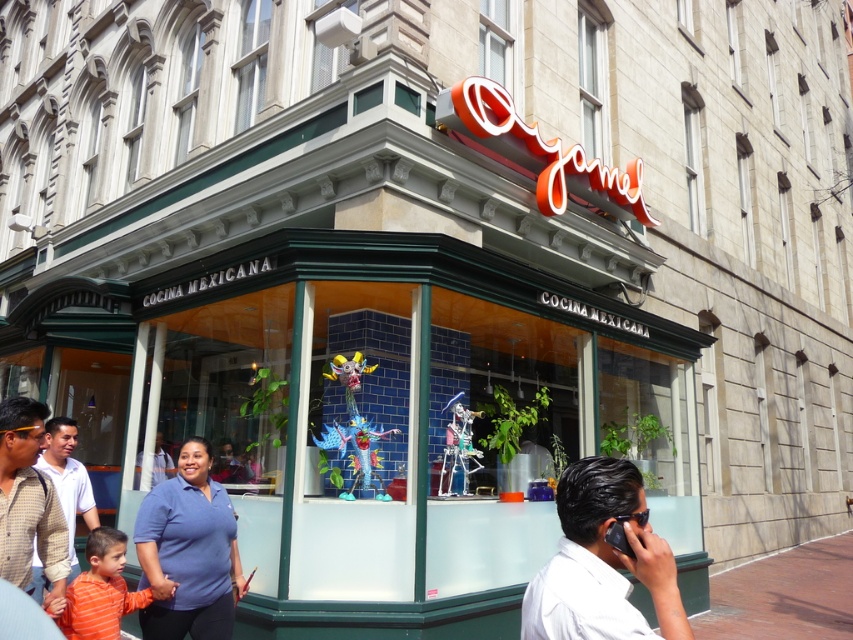
Consider the image. You are standing in front of Cocina Mexicana restaurant and notice the brick pavement at lower right and the checkered fabric shirt at lower left. Which object is wider?

The brick pavement at lower right is wider than the checkered fabric shirt at lower left.

Consider the image. You are a customer approaching the entrance of Cocina Mexicana. You notice the brick pavement at lower right and the orange striped shirt at lower left. Which object is larger in size?

The brick pavement at lower right is bigger than orange striped shirt at lower left, so the brick pavement at lower right is larger in size.